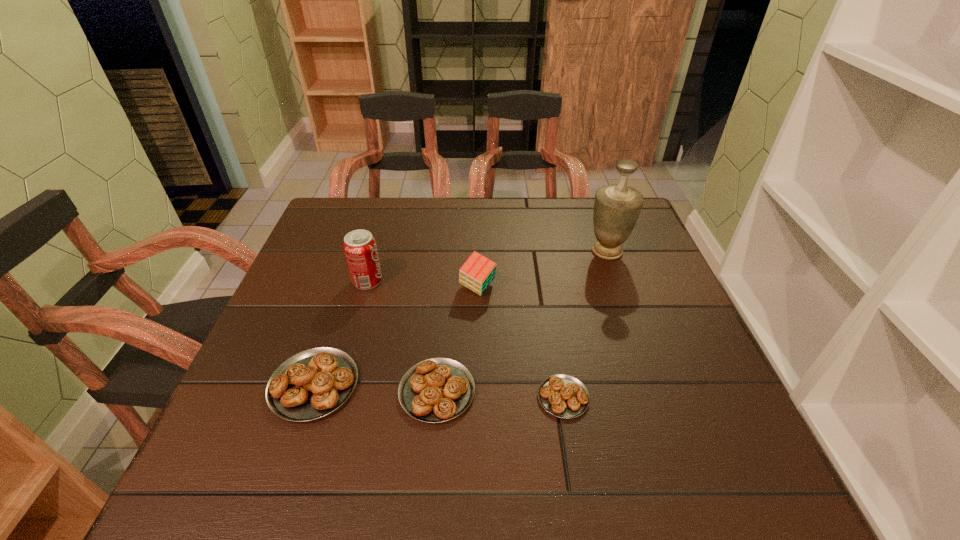
The width and height of the screenshot is (960, 540). Find the location of `the leftmost pastry`. the leftmost pastry is located at coordinates (x=311, y=384).

Locate an element on the screen. The image size is (960, 540). the second shortest pastry is located at coordinates (435, 390).

This screenshot has width=960, height=540. Identify the location of the second pastry from right to left. (435, 390).

At what (x,y) coordinates should I click in order to perform the action: click on the second object from right to left. Please return your answer as a coordinate pair (x, y). This screenshot has height=540, width=960. Looking at the image, I should click on (563, 396).

Identify the location of the shortest object. The width and height of the screenshot is (960, 540). (563, 396).

You are a GUI agent. You are given a task and a screenshot of the screen. Output one action in this format:
    pyautogui.click(x=<x>, y=<y>)
    Task: Click on the soda can
    The image size is (960, 540).
    Given the screenshot: What is the action you would take?
    pyautogui.click(x=360, y=249)

Find the location of a particular element. the rightmost object is located at coordinates (617, 207).

At what (x,y) coordinates should I click in order to perform the action: click on the farthest object. Please return your answer as a coordinate pair (x, y). The height and width of the screenshot is (540, 960). Looking at the image, I should click on (617, 207).

Locate an element on the screen. the fourth shortest object is located at coordinates (476, 274).

Find the location of a particular element. free region located on the right of the leftmost pastry is located at coordinates (434, 385).